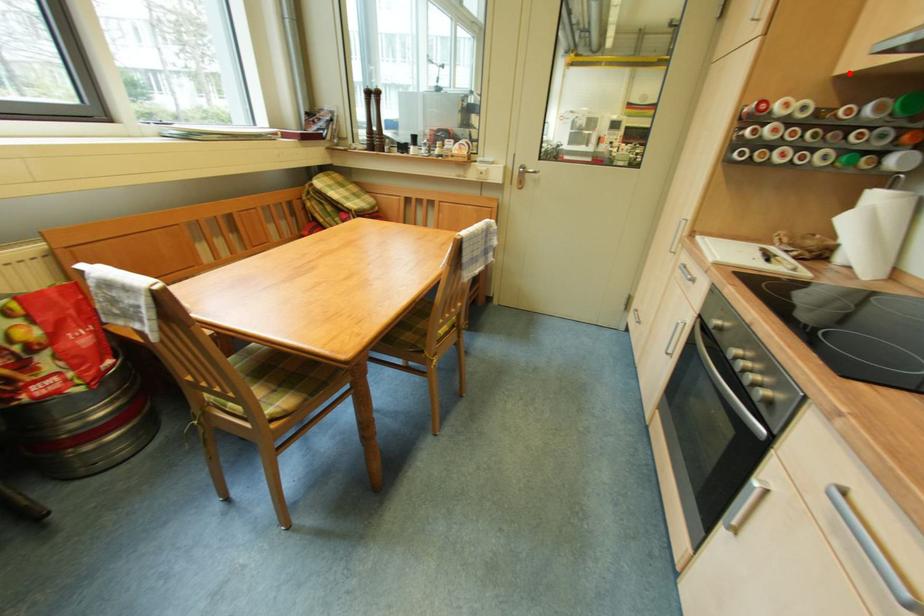
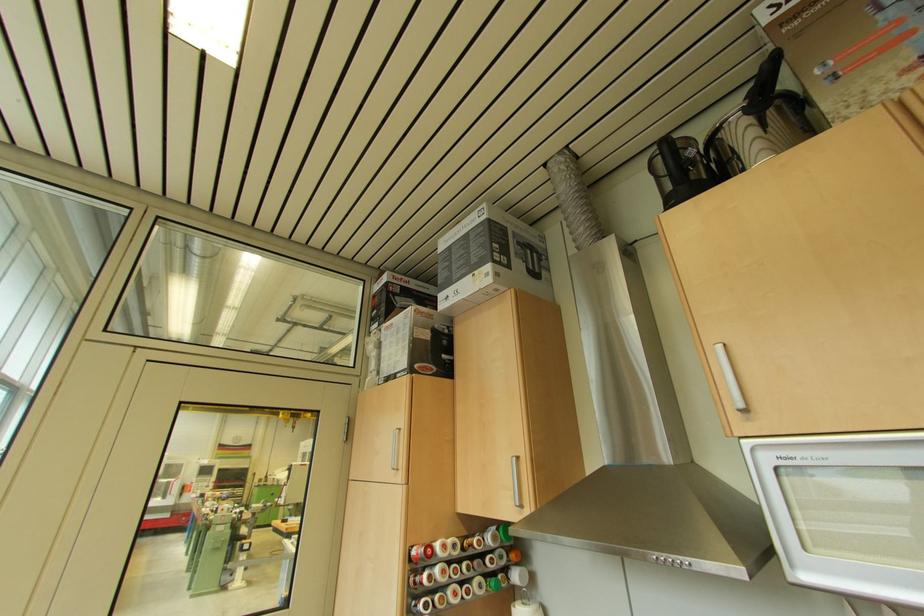
In the second image, find the point that corresponds to the highlighted location in the first image.

(468, 513)